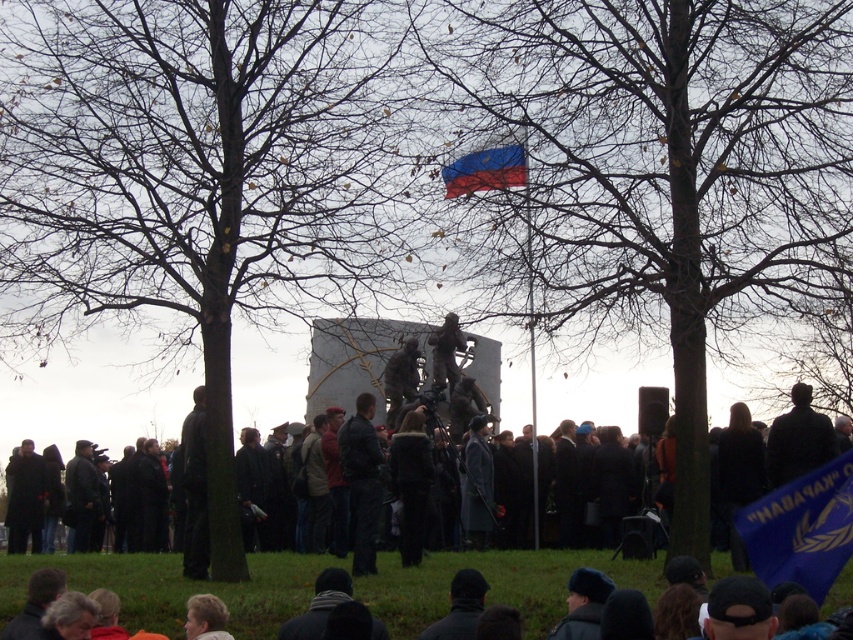
Question: Is blue fabric flag at lower right thinner than red fabric flag at center?

Choices:
 (A) no
 (B) yes

Answer: (A)

Question: Which of these objects is positioned farthest from the blue fabric flag at lower right?

Choices:
 (A) dark gray coat at center
 (B) metallic pole at center
 (C) dark gray jacket at center
 (D) red fabric flag at center

Answer: (D)

Question: Which is farther from the bare wood tree at center?

Choices:
 (A) metallic pole at center
 (B) brown bark tree at center

Answer: (A)

Question: Is bare wood tree at center to the left of metallic pole at center from the viewer's perspective?

Choices:
 (A) yes
 (B) no

Answer: (A)

Question: Which point is closer to the camera?

Choices:
 (A) (515, 157)
 (B) (677, 204)

Answer: (B)

Question: Can you confirm if dark gray jacket at center is bigger than metallic pole at center?

Choices:
 (A) yes
 (B) no

Answer: (B)